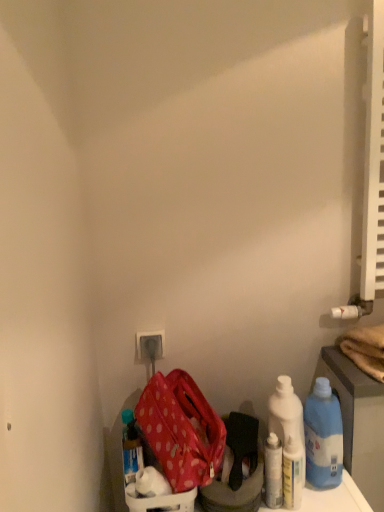
Question: Can you confirm if white glossy bottle at lower right, placed as the third bottle when sorted from left to right, is positioned to the left of white plastic bottles at center right?

Choices:
 (A) no
 (B) yes

Answer: (B)

Question: Can you confirm if white glossy bottle at lower right, acting as the second bottle starting from the right, is smaller than white plastic bottles at center right?

Choices:
 (A) yes
 (B) no

Answer: (A)

Question: Is white plastic bottles at center right at the back of white glossy bottle at lower right, placed as the third bottle when sorted from left to right?

Choices:
 (A) no
 (B) yes

Answer: (B)

Question: Is white glossy bottle at lower right, acting as the second bottle starting from the right, touching white plastic bottles at center right?

Choices:
 (A) yes
 (B) no

Answer: (A)

Question: Is white glossy bottle at lower right, placed as the third bottle when sorted from left to right, aimed at white plastic bottles at center right?

Choices:
 (A) no
 (B) yes

Answer: (A)

Question: Is white glossy bottle at lower right, placed as the third bottle when sorted from left to right, located outside white plastic bottles at center right?

Choices:
 (A) no
 (B) yes

Answer: (B)

Question: Does white plastic bottles at center right have a greater height compared to white glossy bottle at lower right, placed as the third bottle when sorted from left to right?

Choices:
 (A) no
 (B) yes

Answer: (B)

Question: Is white plastic bottles at center right looking in the opposite direction of white glossy bottle at lower right, placed as the third bottle when sorted from left to right?

Choices:
 (A) no
 (B) yes

Answer: (B)

Question: Is white plastic bottles at center right closer to the viewer compared to white glossy bottle at lower right, placed as the third bottle when sorted from left to right?

Choices:
 (A) no
 (B) yes

Answer: (A)

Question: From a real-world perspective, is white plastic bottles at center right on top of white glossy bottle at lower right, placed as the third bottle when sorted from left to right?

Choices:
 (A) yes
 (B) no

Answer: (A)

Question: Is white plastic bottles at center right shorter than white glossy bottle at lower right, placed as the third bottle when sorted from left to right?

Choices:
 (A) yes
 (B) no

Answer: (B)

Question: Is white plastic bottles at center right further to the viewer compared to white glossy bottle at lower right, placed as the third bottle when sorted from left to right?

Choices:
 (A) yes
 (B) no

Answer: (A)

Question: From a real-world perspective, is white glossy bottle at lower right, placed as the third bottle when sorted from left to right, below white plastic electric outlet at lower center?

Choices:
 (A) yes
 (B) no

Answer: (A)